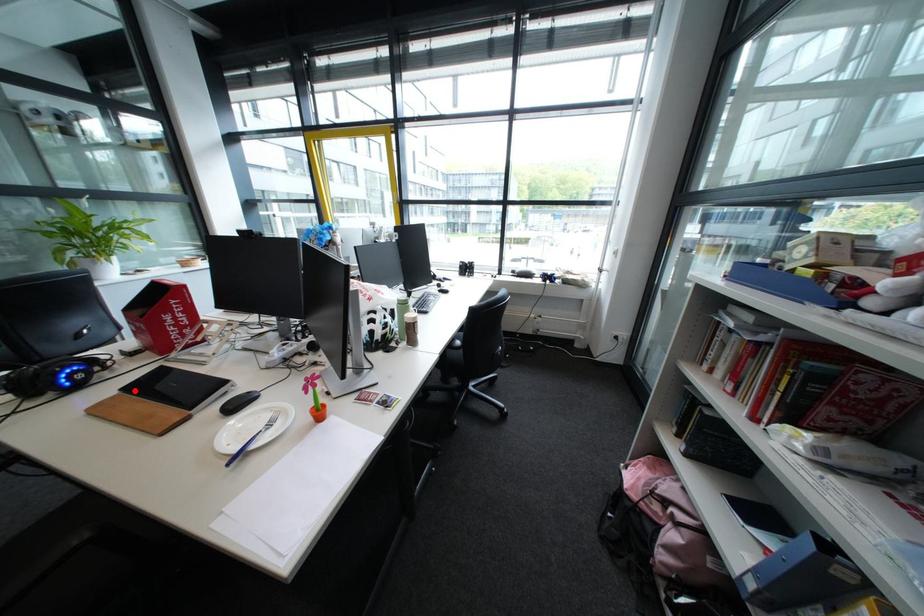
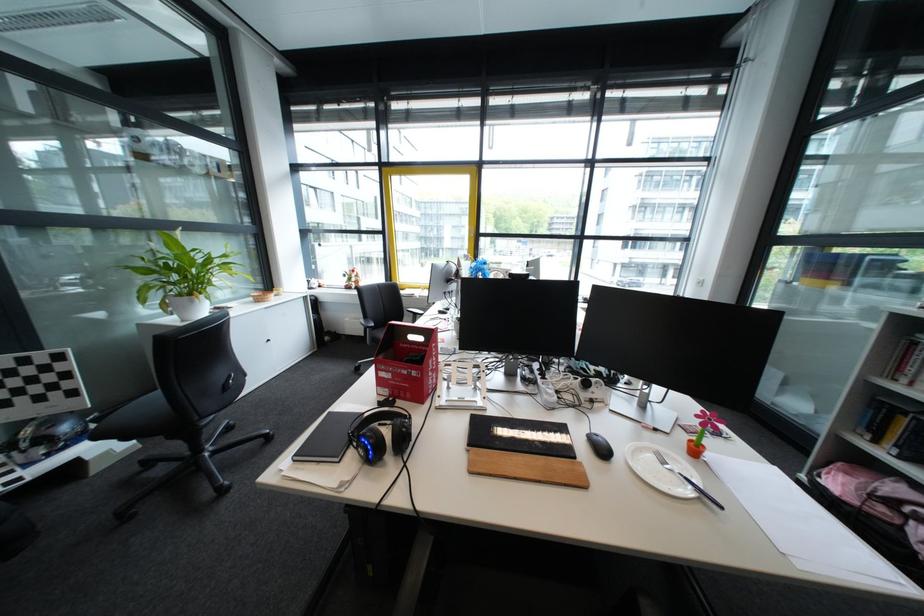
Find the pixel in the second image that matches the highlighted location in the first image.

(481, 446)